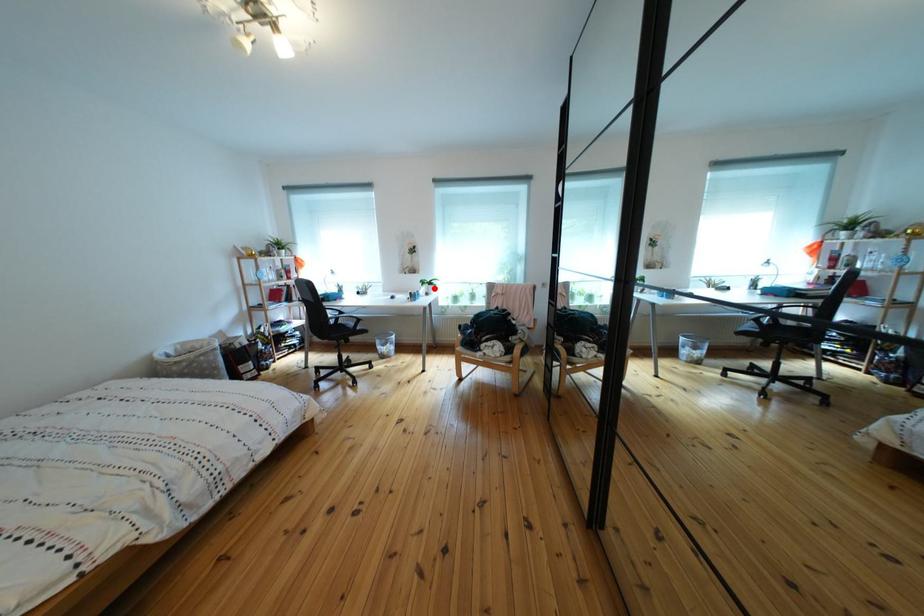
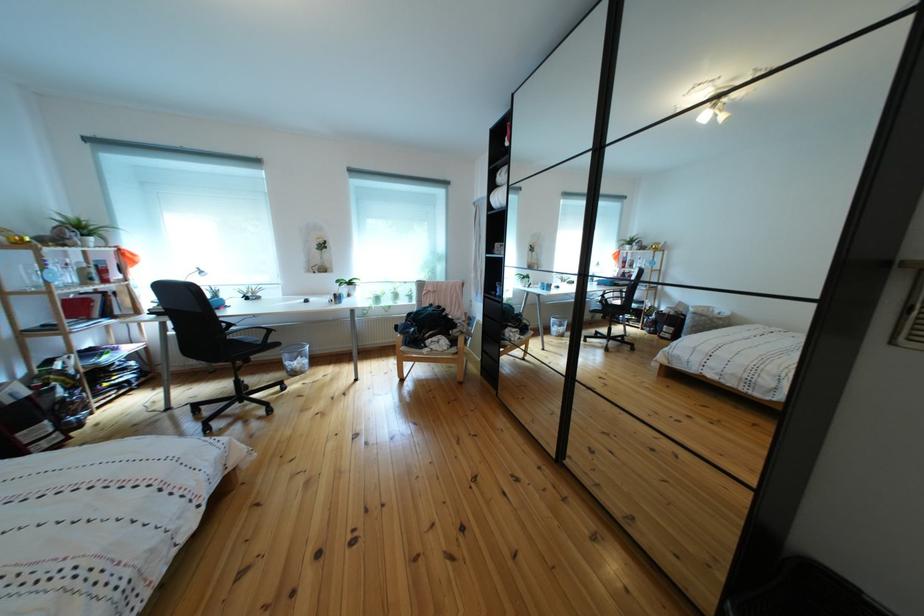
Question: I am providing you with two images of the same scene from different viewpoints. Image1 has a red point marked. In image2, the corresponding 3D location appears at what relative position? Reply with the corresponding letter.

Choices:
 (A) Closer
 (B) Farther

Answer: (A)